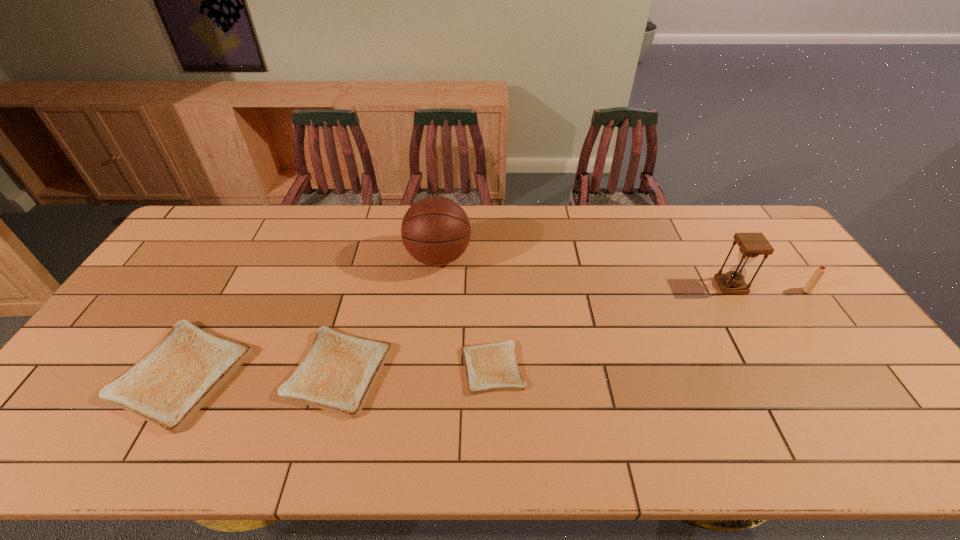
Image resolution: width=960 pixels, height=540 pixels. Identify the location of free space located on the right of the leftmost object. (287, 374).

Locate an element on the screen. The width and height of the screenshot is (960, 540). free space located 0.160m on the right of the fifth tallest object is located at coordinates (451, 370).

This screenshot has width=960, height=540. Find the location of `vacant space located 0.370m on the right of the shortest toast`. vacant space located 0.370m on the right of the shortest toast is located at coordinates (668, 368).

The height and width of the screenshot is (540, 960). In order to click on free space located 0.290m on the front of the second tallest object in this screenshot , I will do `click(783, 378)`.

This screenshot has height=540, width=960. Find the location of `free spot located 0.310m on the left of the tallest object`. free spot located 0.310m on the left of the tallest object is located at coordinates (311, 258).

Locate an element on the screen. vacant space situated 0.300m on the front of the third tallest object is located at coordinates (874, 380).

Identify the location of object that is at the far edge. (435, 230).

Identify the location of object that is at the left edge. Image resolution: width=960 pixels, height=540 pixels. (167, 387).

Find the location of a particular element. The height and width of the screenshot is (540, 960). object that is positioned at the right edge is located at coordinates (820, 271).

At what (x,y) coordinates should I click in order to perform the action: click on object located at the near left corner. Please return your answer as a coordinate pair (x, y). Looking at the image, I should click on (167, 387).